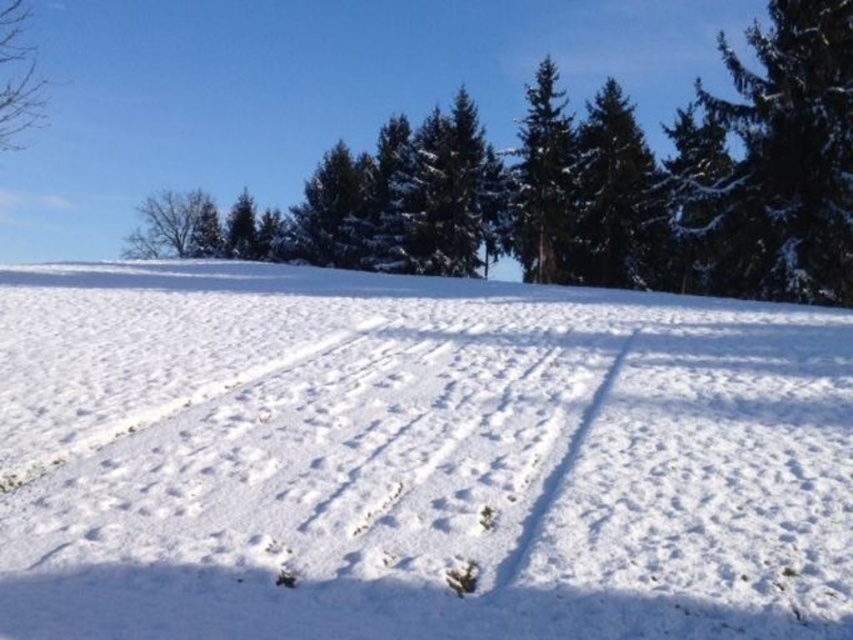
You are standing in the winter landscape and want to walk towards the green matte tree at upper center. Which direction should you go relative to the bare branches at left?

You should walk towards the green matte tree at upper center, which is closer to you than the bare branches at left, so it is in front of the bare branches at left. Therefore, you should head in the direction of the green matte tree at upper center, which is toward the upper center and in front of the bare branches at left.

You are standing at the point marked as point [614,196] in the winter landscape. What object is located exactly at that point?

The green matte tree at upper center is located exactly at point [614,196].